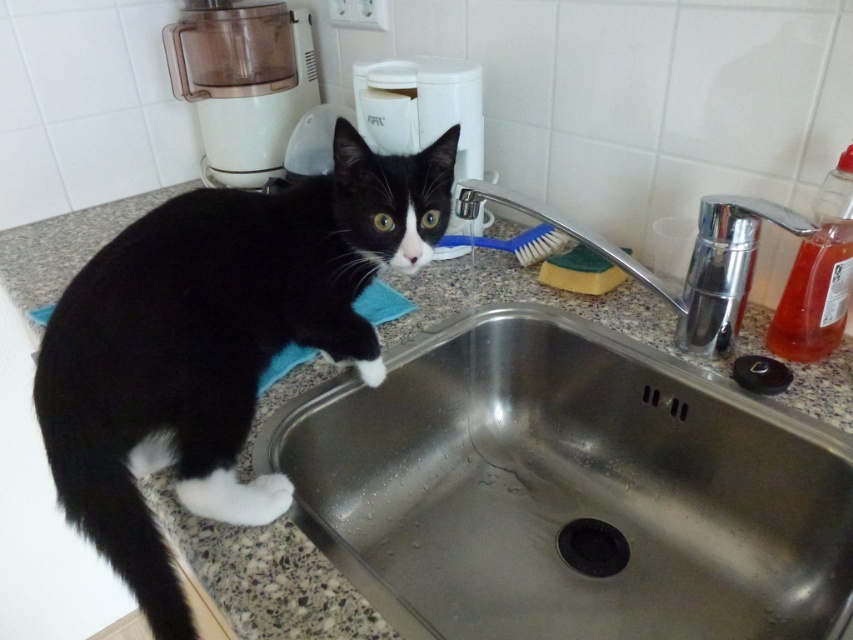
In the kitchen scene, there is a black fur cat at upper left and a blue plastic brush at center. Which object is taller?

The black fur cat at upper left is much taller than the blue plastic brush at center.

You are a robotic cat feeder that needs to place a food bowl between the black fur cat at upper left and the blue plastic brush at center. The bowl has a diameter of 12 inches. Is there enough space to place the bowl without moving either object?

The distance between the black fur cat at upper left and the blue plastic brush at center is 16.54 inches. Since the bowl requires 12 inches of space, there is sufficient room to place it between them without moving either object.

You are a chef who needs to wash dishes. You see the chrome metallic faucet at upper right and the black rubber drain at lower center. Which object should you turn on to start the water flow?

The chrome metallic faucet at upper right should be turned on to start the water flow because it is positioned to the right of the black rubber drain at lower center, which is typically where faucets are located for directing water towards the drain.